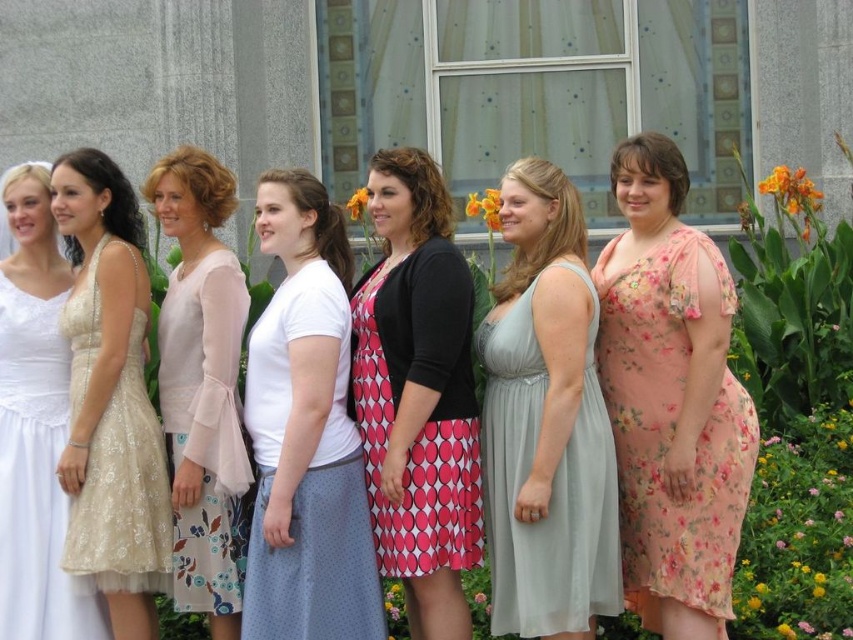
Question: Estimate the real-world distances between objects in this image. Which object is closer to the pink dotted dress at center?

Choices:
 (A) orange matte flower at upper right
 (B) pink fabric flower at center

Answer: (B)

Question: Which point is farther from the camera taking this photo?

Choices:
 (A) click(x=354, y=192)
 (B) click(x=425, y=556)
 (C) click(x=477, y=592)

Answer: (A)

Question: Is orange fabric flower at upper center wider than pink fabric flower at center?

Choices:
 (A) no
 (B) yes

Answer: (B)

Question: Among these objects, which one is nearest to the camera?

Choices:
 (A) white matte shirt at center
 (B) iridescent lace dress at left

Answer: (A)

Question: Can you confirm if orange matte flower at upper right is thinner than pink fabric flower at center?

Choices:
 (A) yes
 (B) no

Answer: (B)

Question: Can you confirm if white matte shirt at center is bigger than orange fabric flower at upper center?

Choices:
 (A) no
 (B) yes

Answer: (B)